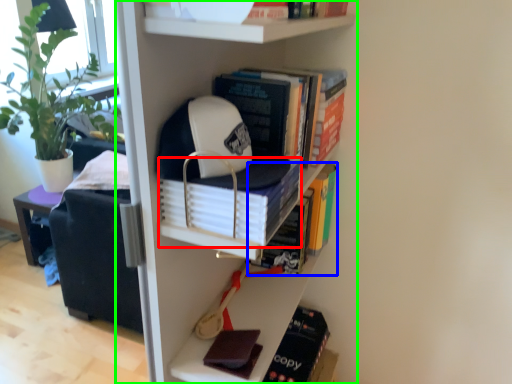
Question: Estimate the real-world distances between objects in this image. Which object is farther from book (highlighted by a red box), book (highlighted by a blue box) or bookcase (highlighted by a green box)?

Choices:
 (A) book
 (B) bookcase

Answer: (A)